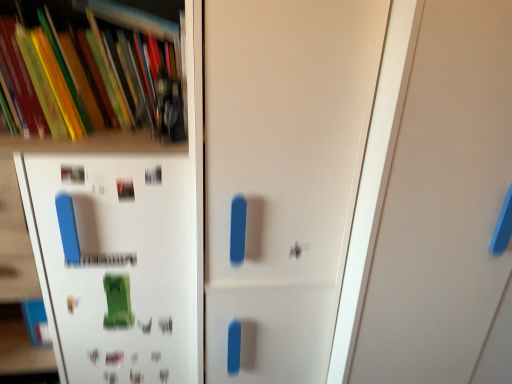
Question: Is matte plastic books at upper left oriented towards white matte shelf at upper left?

Choices:
 (A) yes
 (B) no

Answer: (A)

Question: From a real-world perspective, is matte plastic books at upper left positioned under white matte shelf at upper left based on gravity?

Choices:
 (A) yes
 (B) no

Answer: (B)

Question: Considering the relative sizes of matte plastic books at upper left and white matte shelf at upper left in the image provided, is matte plastic books at upper left bigger than white matte shelf at upper left?

Choices:
 (A) yes
 (B) no

Answer: (B)

Question: Can you confirm if matte plastic books at upper left is thinner than white matte shelf at upper left?

Choices:
 (A) yes
 (B) no

Answer: (A)

Question: Is matte plastic books at upper left outside white matte shelf at upper left?

Choices:
 (A) yes
 (B) no

Answer: (B)

Question: Is matte plastic books at upper left looking in the opposite direction of white matte shelf at upper left?

Choices:
 (A) no
 (B) yes

Answer: (B)

Question: From the image's perspective, is matte white door at center, the 2th door from the right, beneath white matte shelf at upper left?

Choices:
 (A) yes
 (B) no

Answer: (A)

Question: Is white matte shelf at upper left at the back of matte white door at center, the 2th door from the right?

Choices:
 (A) yes
 (B) no

Answer: (B)

Question: Is matte white door at center, the 2th door from the right, at the left side of white matte shelf at upper left?

Choices:
 (A) no
 (B) yes

Answer: (A)

Question: Can you confirm if matte white door at center, marked as the 1th door in a left-to-right arrangement, is positioned to the right of white matte shelf at upper left?

Choices:
 (A) no
 (B) yes

Answer: (B)

Question: From the image's perspective, would you say matte white door at center, the 2th door from the right, is positioned over white matte shelf at upper left?

Choices:
 (A) no
 (B) yes

Answer: (A)

Question: Can you confirm if matte white door at center, the 2th door from the right, is wider than white matte shelf at upper left?

Choices:
 (A) no
 (B) yes

Answer: (A)

Question: Is matte plastic books at upper left facing away from matte white door at center, marked as the 1th door in a left-to-right arrangement?

Choices:
 (A) yes
 (B) no

Answer: (B)